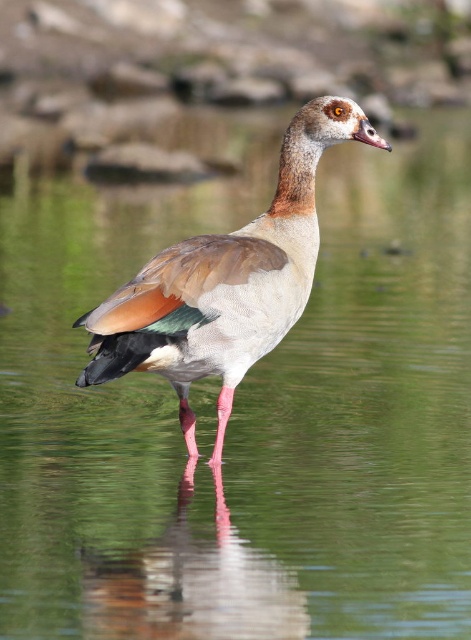
Question: Is brown feathered goose at center further to camera compared to glossy water at center?

Choices:
 (A) no
 (B) yes

Answer: (B)

Question: Is brown feathered goose at center above glossy water at center?

Choices:
 (A) yes
 (B) no

Answer: (A)

Question: Which object appears closest to the camera in this image?

Choices:
 (A) glossy water at center
 (B) brown feathered goose at center

Answer: (A)

Question: Is brown feathered goose at center behind glossy water at center?

Choices:
 (A) yes
 (B) no

Answer: (A)

Question: Which point is closer to the camera?

Choices:
 (A) glossy water at center
 (B) brown feathered goose at center

Answer: (A)